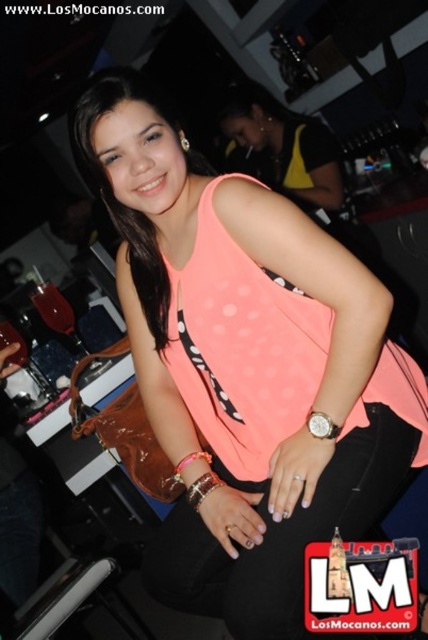
Measure the distance between point (222, 481) and camera.

3.80 feet

Is silver metallic bracelet at wrist wider than leather wristband at lower center?

In fact, silver metallic bracelet at wrist might be narrower than leather wristband at lower center.

Is point (193, 493) farther from camera compared to point (184, 458)?

No, it is not.

This screenshot has height=640, width=428. I want to click on silver metallic bracelet at wrist, so click(202, 486).

Does point (240, 529) come behind point (190, 456)?

No.

Is neon orange fabric top at center further to camera compared to leather wristband at lower center?

No, neon orange fabric top at center is closer to the viewer.

Which is in front, point (178, 570) or point (199, 456)?

Positioned in front is point (199, 456).

Locate an element on the screen. neon orange fabric top at center is located at coordinates (246, 364).

This screenshot has width=428, height=640. In order to click on neon orange fabric top at center in this screenshot , I will do `click(246, 364)`.

Describe the element at coordinates (246, 364) in the screenshot. I see `neon orange fabric top at center` at that location.

What do you see at coordinates (246, 364) in the screenshot? I see `neon orange fabric top at center` at bounding box center [246, 364].

Where is `neon orange fabric top at center`? Image resolution: width=428 pixels, height=640 pixels. neon orange fabric top at center is located at coordinates (246, 364).